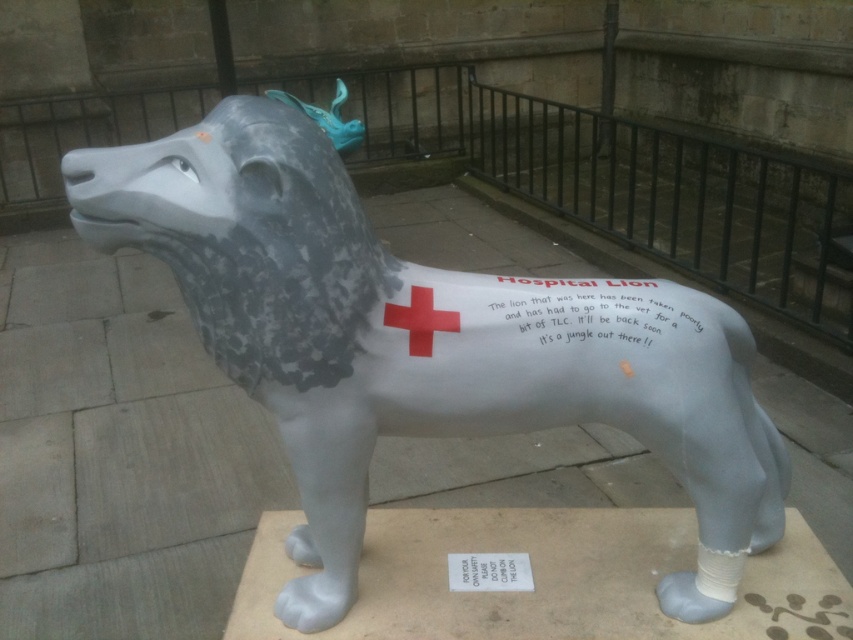
You are a delivery person who needs to place a package between the white paper at center and the white paper at lower center. The package is 26 inches long. Can you fit it between them without bending the package?

The distance between the white paper at center and the white paper at lower center is 25.73 inches. Since the package is 26 inches long, it is slightly longer than the available space. Therefore, you cannot fit the package between them without bending it.